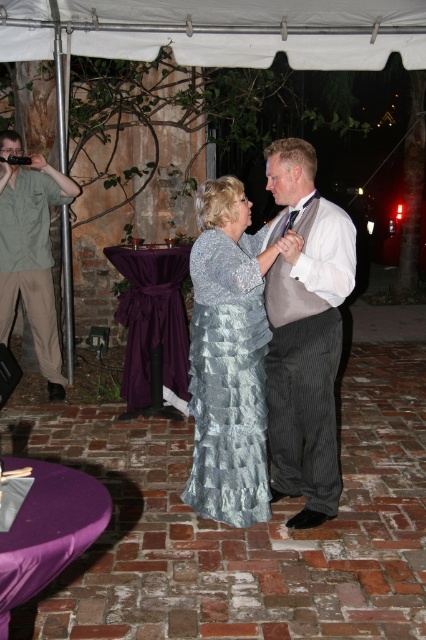
Which is behind, point (43, 36) or point (276, 477)?

The point (43, 36) is more distant.

Which is below, white fabric canopy at upper center or pinstriped fabric suit at center?

pinstriped fabric suit at center is lower down.

You are a GUI agent. You are given a task and a screenshot of the screen. Output one action in this format:
    pyautogui.click(x=<x>, y=<y>)
    Task: Click on the white fabric canopy at upper center
    This screenshot has width=426, height=640.
    Given the screenshot: What is the action you would take?
    pyautogui.click(x=221, y=29)

You are a GUI agent. You are given a task and a screenshot of the screen. Output one action in this format:
    pyautogui.click(x=<x>, y=<y>)
    Task: Click on the white fabric canopy at upper center
    The width and height of the screenshot is (426, 640).
    Given the screenshot: What is the action you would take?
    pyautogui.click(x=221, y=29)

Looking at this image, who is more distant from viewer, (x=9, y=44) or (x=224, y=236)?

The point (x=9, y=44) is more distant.

Between white fabric canopy at upper center and shiny silver dress at center, which one is positioned higher?

white fabric canopy at upper center is higher up.

Who is more forward, [141,19] or [238,378]?

Positioned in front is point [238,378].

In order to click on white fabric canopy at upper center in this screenshot , I will do `click(221, 29)`.

Can you confirm if white fabric canopy at upper center is thinner than green shirt at left?

Incorrect, white fabric canopy at upper center's width is not less than green shirt at left's.

This screenshot has height=640, width=426. I want to click on white fabric canopy at upper center, so click(x=221, y=29).